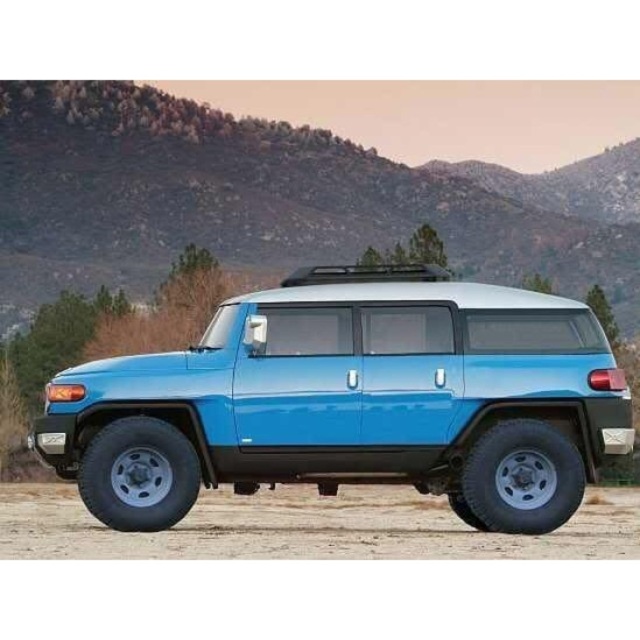
Question: Which of the following is the closest to the observer?

Choices:
 (A) (401, 364)
 (B) (296, 538)

Answer: (A)

Question: Which point is closer to the camera?

Choices:
 (A) dirt field at lower center
 (B) matte blue suv at center

Answer: (A)

Question: Is matte blue suv at center in front of dirt field at lower center?

Choices:
 (A) yes
 (B) no

Answer: (B)

Question: Can you confirm if matte blue suv at center is bigger than dirt field at lower center?

Choices:
 (A) yes
 (B) no

Answer: (A)

Question: Does matte blue suv at center appear over dirt field at lower center?

Choices:
 (A) yes
 (B) no

Answer: (A)